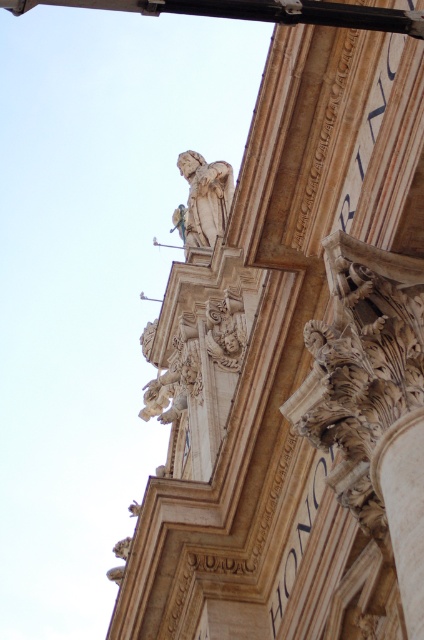
Question: Which point is farther to the camera?

Choices:
 (A) (239, 314)
 (B) (178, 211)
 (C) (122, 4)
 (D) (406, 422)

Answer: (B)

Question: Does white stone column at lower right have a greater width compared to white marble statue at upper center?

Choices:
 (A) yes
 (B) no

Answer: (B)

Question: Which of the following is the closest to the observer?

Choices:
 (A) white marble statue at upper center
 (B) white stone column at lower right
 (C) black metal pole at upper center

Answer: (C)

Question: Can you confirm if black metal pole at upper center is bigger than white marble statue at upper center?

Choices:
 (A) yes
 (B) no

Answer: (A)

Question: Is black metal pole at upper center to the right of white marble sculpture at center from the viewer's perspective?

Choices:
 (A) no
 (B) yes

Answer: (A)

Question: Which point is farther from the camera taking this photo?

Choices:
 (A) (298, 8)
 (B) (418, 444)
 (C) (225, 346)

Answer: (C)